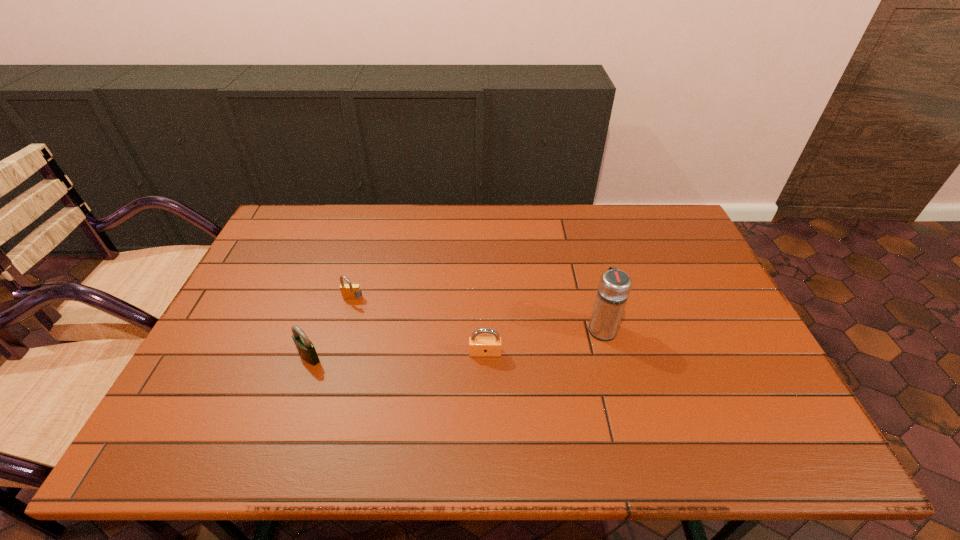
Locate an element on the screen. free spot between the third object from left to right and the farthest object is located at coordinates (419, 326).

Locate an element on the screen. This screenshot has height=540, width=960. vacant space that is in between the third object from right to left and the leftmost object is located at coordinates (331, 328).

Find the location of `vacant area between the leftmost object and the second farthest object`. vacant area between the leftmost object and the second farthest object is located at coordinates (455, 342).

Identify the location of vacant point located between the rightmost padlock and the rightmost object. This screenshot has width=960, height=540. (543, 340).

Where is `empty space between the rightmost object and the leftmost object`? Image resolution: width=960 pixels, height=540 pixels. empty space between the rightmost object and the leftmost object is located at coordinates (455, 342).

Locate an element on the screen. empty space between the leftmost padlock and the second padlock from right to left is located at coordinates (331, 328).

I want to click on free space between the farthest object and the rightmost padlock, so click(x=419, y=326).

Locate an element on the screen. free space between the third object from right to left and the tallest object is located at coordinates (477, 314).

Find the location of a particular element. The width and height of the screenshot is (960, 540). vacant space in between the third object from left to right and the third nearest object is located at coordinates point(543,340).

At what (x,y) coordinates should I click in order to perform the action: click on object that is the third closest to the leftmost object. Please return your answer as a coordinate pair (x, y). This screenshot has height=540, width=960. Looking at the image, I should click on (614, 287).